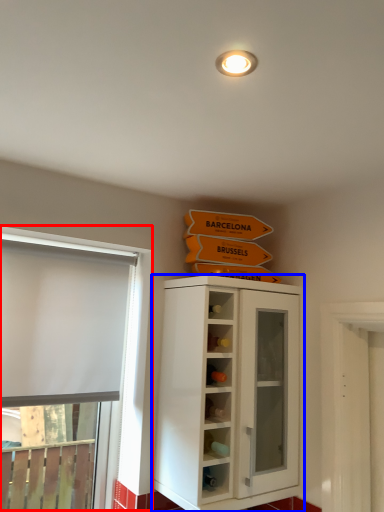
Question: Which object is closer to the camera taking this photo, window (highlighted by a red box) or cupboard (highlighted by a blue box)?

Choices:
 (A) window
 (B) cupboard

Answer: (B)